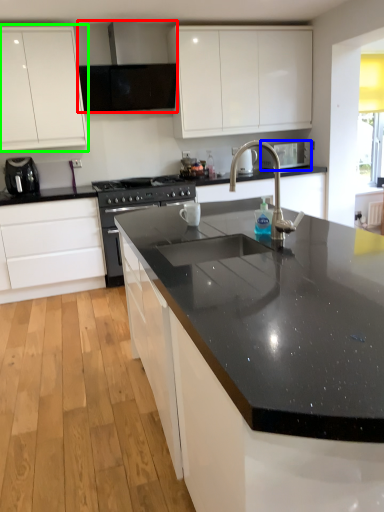
Question: Estimate the real-world distances between objects in this image. Which object is closer to exhaust hood (highlighted by a red box), appliance (highlighted by a blue box) or cabinetry (highlighted by a green box)?

Choices:
 (A) appliance
 (B) cabinetry

Answer: (B)